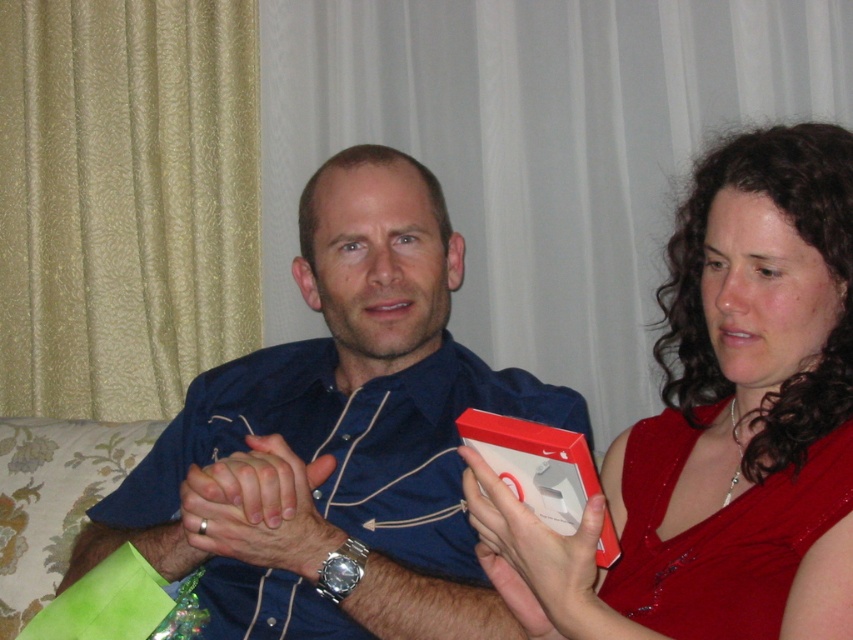
You are standing in the living room where the man and woman are sitting. You want to place a small plant pot that is 0.5 meters tall on the floor. Is there enough space between you and the point at coordinates point (x=337, y=381) to place it without it being in the way?

The distance between you and point (x=337, y=381) is 1.29 meters. Since the plant pot is only 0.5 meters tall, there is sufficient space to place it without obstruction.

You are a fashion designer observing two men in a living room. You notice the blue satin shirt at center and the matte blue shirt at center. Which shirt is located to the right of the other?

The blue satin shirt at center is positioned on the right side of matte blue shirt at center.